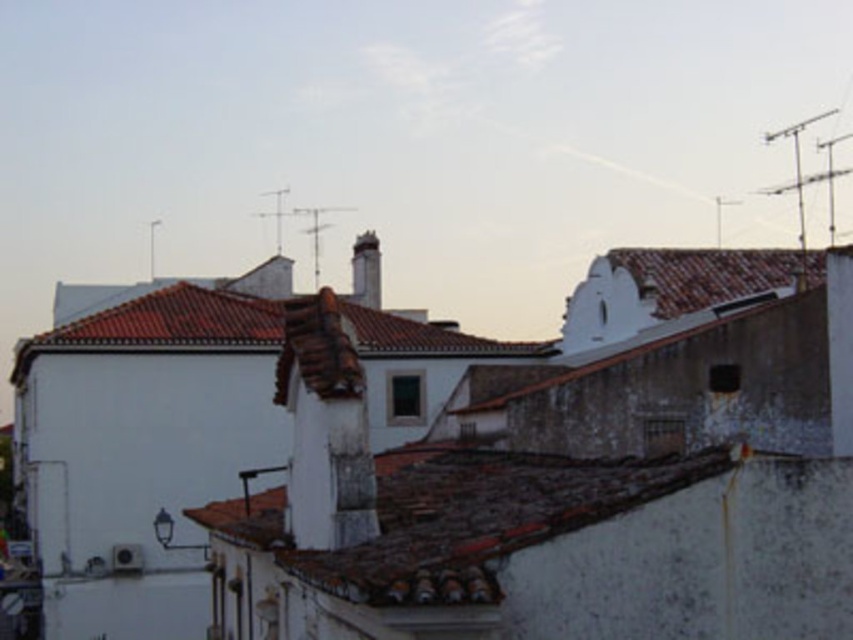
Question: Is brown tile roof at center wider than white stone chimney at center?

Choices:
 (A) yes
 (B) no

Answer: (A)

Question: Among these points, which one is farthest from the camera?

Choices:
 (A) (372, 298)
 (B) (541, 525)

Answer: (A)

Question: Observing the image, what is the correct spatial positioning of brown tile roof at center in reference to white stone chimney at center?

Choices:
 (A) left
 (B) right

Answer: (B)

Question: Can you confirm if brown tile roof at center is thinner than white stone chimney at center?

Choices:
 (A) no
 (B) yes

Answer: (A)